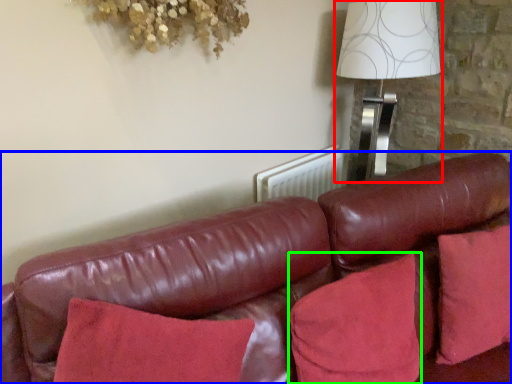
Question: Which is nearer to the table lamp (highlighted by a red box)? studio couch (highlighted by a blue box) or pillow (highlighted by a green box).

Choices:
 (A) studio couch
 (B) pillow

Answer: (A)